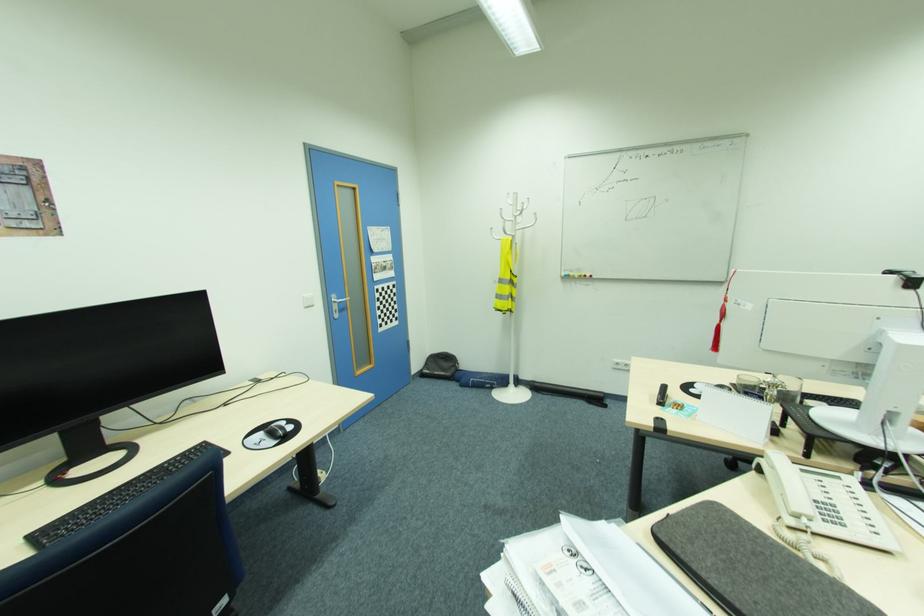
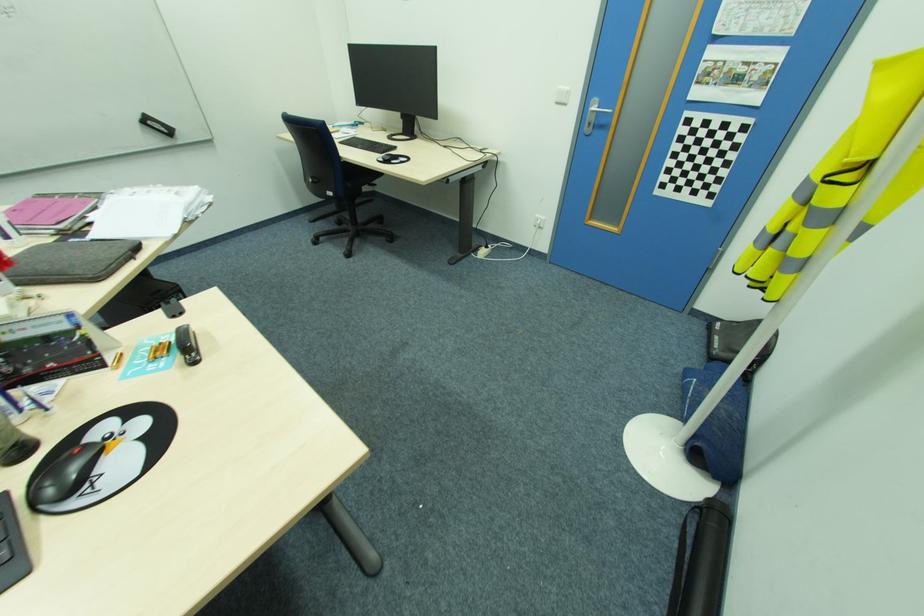
Locate, in the second image, the point that corresponds to pixel 341 300 in the first image.

(600, 108)